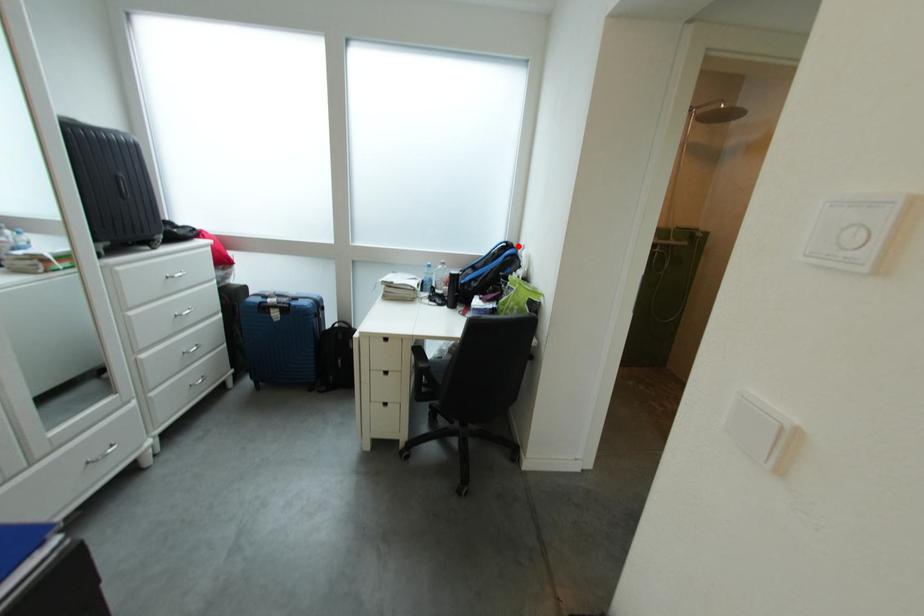
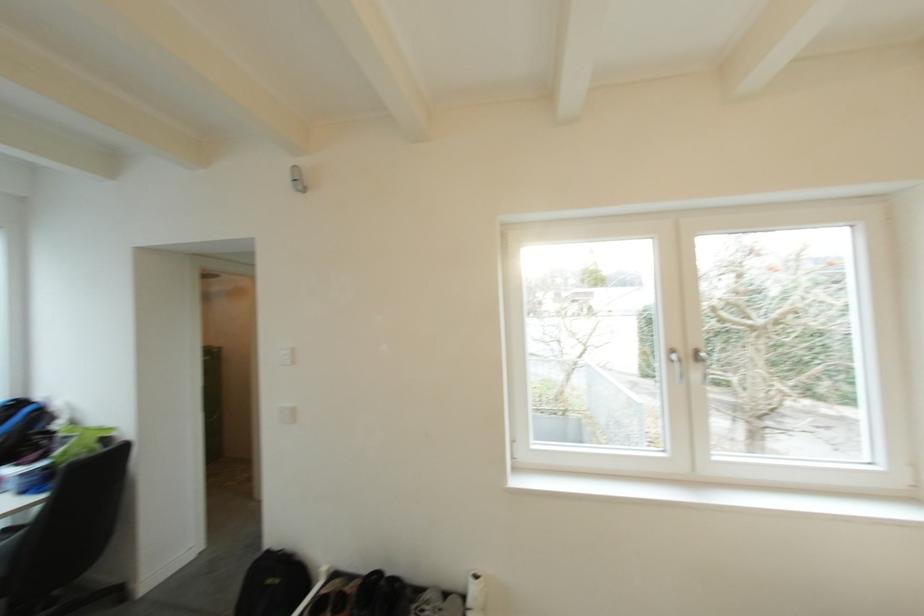
Locate, in the second image, the point that corresponds to the highlighted location in the first image.

(29, 403)